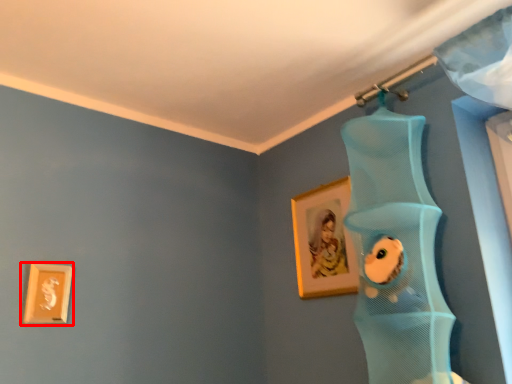
Question: From the image's perspective, considering the relative positions of picture frame (annotated by the red box) and picture frame in the image provided, where is picture frame (annotated by the red box) located with respect to the staircase?

Choices:
 (A) above
 (B) below

Answer: (B)